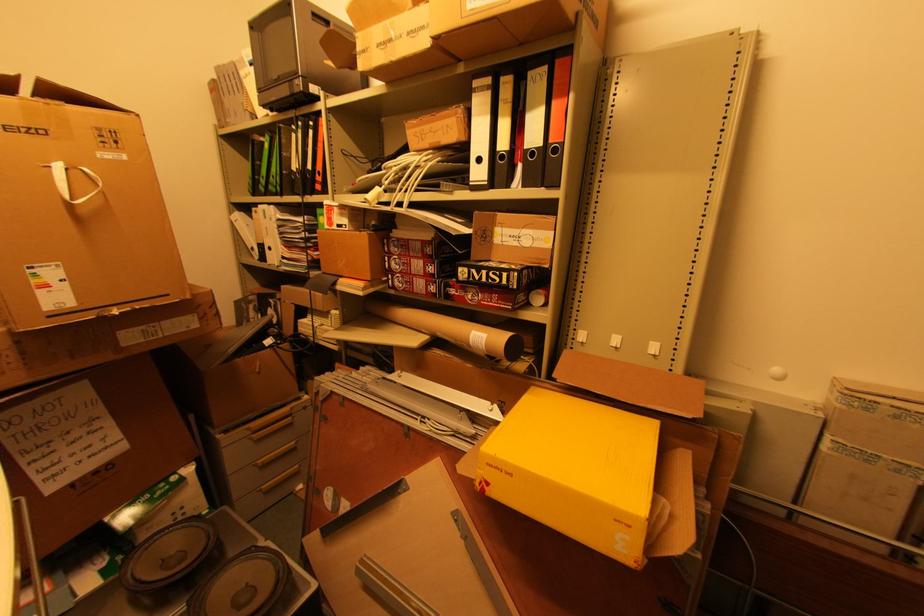
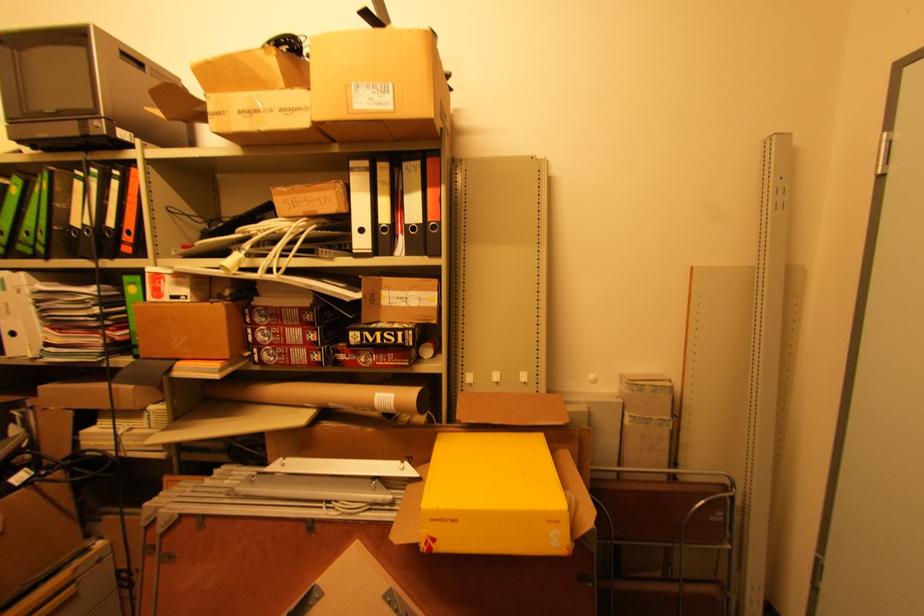
Locate, in the second image, the point that corresponds to pixel 482 161 in the first image.

(365, 231)